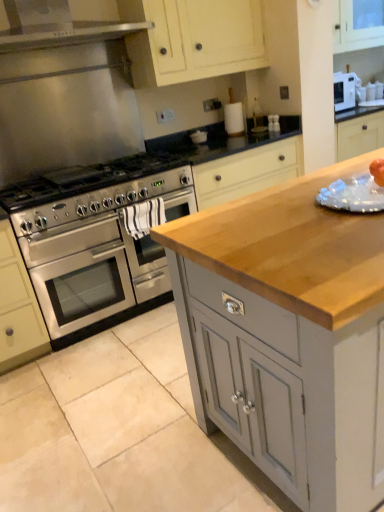
Question: Is wooden countertop at center, which is the first cabinetry in front-to-back order, far from matte cream cabinet at upper center, placed as the first cabinetry when sorted from top to bottom?

Choices:
 (A) no
 (B) yes

Answer: (B)

Question: Does wooden countertop at center, which is the 2th cabinetry from top to bottom, have a lesser height compared to matte cream cabinet at upper center, which is the first cabinetry from back to front?

Choices:
 (A) yes
 (B) no

Answer: (B)

Question: Is wooden countertop at center, which is the first cabinetry in front-to-back order, thinner than matte cream cabinet at upper center, which is the 2th cabinetry in front-to-back order?

Choices:
 (A) no
 (B) yes

Answer: (A)

Question: Is the depth of wooden countertop at center, the second cabinetry viewed from the back, greater than that of matte cream cabinet at upper center, which is counted as the 2th cabinetry, starting from the bottom?

Choices:
 (A) yes
 (B) no

Answer: (B)

Question: Does wooden countertop at center, the 1th cabinetry when ordered from bottom to top, appear on the left side of matte cream cabinet at upper center, which is the 2th cabinetry in front-to-back order?

Choices:
 (A) yes
 (B) no

Answer: (B)

Question: Is wooden countertop at center, the 1th cabinetry when ordered from bottom to top, inside or outside of stainless steel gas stove at left?

Choices:
 (A) inside
 (B) outside

Answer: (B)

Question: From the image's perspective, is wooden countertop at center, the 1th cabinetry when ordered from bottom to top, positioned above or below stainless steel gas stove at left?

Choices:
 (A) above
 (B) below

Answer: (B)

Question: Visually, is wooden countertop at center, which is the 2th cabinetry from top to bottom, positioned to the left or to the right of stainless steel gas stove at left?

Choices:
 (A) right
 (B) left

Answer: (A)

Question: From a real-world perspective, is wooden countertop at center, which is the 2th cabinetry from top to bottom, above or below stainless steel gas stove at left?

Choices:
 (A) below
 (B) above

Answer: (A)

Question: Looking at their shapes, would you say stainless steel gas stove at left is wider or thinner than wooden countertop at center, the 1th cabinetry when ordered from bottom to top?

Choices:
 (A) wide
 (B) thin

Answer: (B)

Question: Which is correct: stainless steel gas stove at left is inside wooden countertop at center, which is the first cabinetry in front-to-back order, or outside of it?

Choices:
 (A) outside
 (B) inside

Answer: (A)

Question: From a real-world perspective, is stainless steel gas stove at left physically located above or below wooden countertop at center, which is the first cabinetry in front-to-back order?

Choices:
 (A) above
 (B) below

Answer: (A)

Question: Relative to wooden countertop at center, the 1th cabinetry when ordered from bottom to top, is stainless steel gas stove at left in front or behind?

Choices:
 (A) front
 (B) behind

Answer: (B)

Question: In terms of width, does matte cream cabinet at upper center, placed as the first cabinetry when sorted from top to bottom, look wider or thinner when compared to stainless steel oven at left?

Choices:
 (A) thin
 (B) wide

Answer: (A)

Question: Relative to stainless steel oven at left, is matte cream cabinet at upper center, which is the 2th cabinetry in front-to-back order, in front or behind?

Choices:
 (A) behind
 (B) front

Answer: (A)